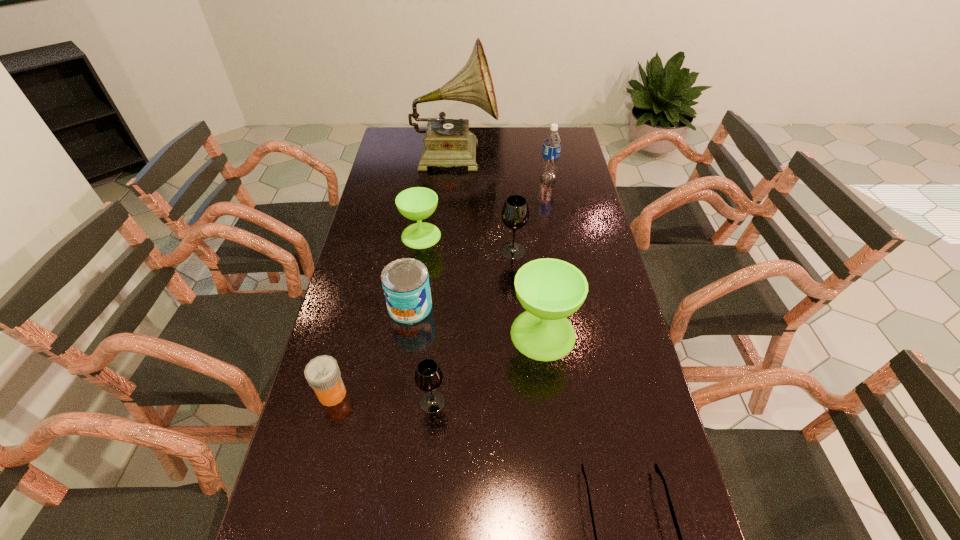
Find the location of a particular element. The height and width of the screenshot is (540, 960). free region located on the right of the blue can is located at coordinates (564, 307).

Identify the location of vacant position located on the label side of the orange medicine. pyautogui.click(x=484, y=394).

The width and height of the screenshot is (960, 540). Find the location of `object located in the far edge section of the desktop`. object located in the far edge section of the desktop is located at coordinates (448, 142).

Locate an element on the screen. record player that is at the left edge is located at coordinates (448, 142).

At what (x,y) coordinates should I click in order to perform the action: click on wineglass at the left edge. Please return your answer as a coordinate pair (x, y). The image size is (960, 540). Looking at the image, I should click on (417, 203).

Where is `can that is at the left edge`? can that is at the left edge is located at coordinates (405, 282).

This screenshot has width=960, height=540. In order to click on medicine that is at the left edge in this screenshot , I will do `click(322, 373)`.

Find the location of a particular element. Image resolution: width=960 pixels, height=540 pixels. water bottle that is at the right edge is located at coordinates (552, 142).

At what (x,y) coordinates should I click in order to perform the action: click on wineglass positioned at the right edge. Please return your answer as a coordinate pair (x, y). Looking at the image, I should click on (550, 290).

You are a GUI agent. You are given a task and a screenshot of the screen. Output one action in this format:
    pyautogui.click(x=<x>, y=<y>)
    Task: Click on the object present at the far left corner
    Image resolution: width=960 pixels, height=540 pixels.
    Given the screenshot: What is the action you would take?
    pyautogui.click(x=448, y=142)